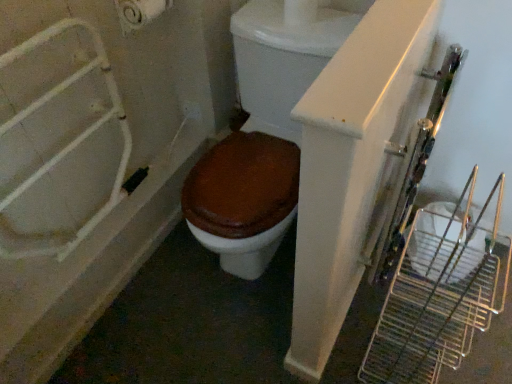
Question: Does brown matte toilet at center have a lesser height compared to white matte toilet paper at upper left?

Choices:
 (A) no
 (B) yes

Answer: (A)

Question: Is brown matte toilet at center positioned with its back to white matte toilet paper at upper left?

Choices:
 (A) yes
 (B) no

Answer: (B)

Question: From a real-world perspective, is brown matte toilet at center located beneath white matte toilet paper at upper left?

Choices:
 (A) yes
 (B) no

Answer: (A)

Question: From a real-world perspective, is brown matte toilet at center located higher than white matte toilet paper at upper left?

Choices:
 (A) no
 (B) yes

Answer: (A)

Question: Is brown matte toilet at center located outside white matte toilet paper at upper left?

Choices:
 (A) no
 (B) yes

Answer: (B)

Question: From a real-world perspective, relative to brown matte toilet at center, is white matte toilet paper at upper left vertically above or below?

Choices:
 (A) above
 (B) below

Answer: (A)

Question: Choose the correct answer: Is white matte toilet paper at upper left inside brown matte toilet at center or outside it?

Choices:
 (A) outside
 (B) inside

Answer: (A)

Question: Looking at the image, does white matte toilet paper at upper left seem bigger or smaller compared to brown matte toilet at center?

Choices:
 (A) big
 (B) small

Answer: (B)

Question: Is point (138, 3) closer or farther from the camera than point (231, 251)?

Choices:
 (A) farther
 (B) closer

Answer: (A)

Question: In the image, is white glossy bathtub at left positioned in front of or behind white matte toilet paper at upper left?

Choices:
 (A) front
 (B) behind

Answer: (A)

Question: From the image's perspective, is white glossy bathtub at left positioned above or below white matte toilet paper at upper left?

Choices:
 (A) above
 (B) below

Answer: (B)

Question: Considering the positions of white glossy bathtub at left and white matte toilet paper at upper left in the image, is white glossy bathtub at left wider or thinner than white matte toilet paper at upper left?

Choices:
 (A) thin
 (B) wide

Answer: (B)

Question: From a real-world perspective, is white glossy bathtub at left above or below white matte toilet paper at upper left?

Choices:
 (A) below
 (B) above

Answer: (A)

Question: Is white matte toilet paper at upper left wider or thinner than white glossy bathtub at left?

Choices:
 (A) wide
 (B) thin

Answer: (B)

Question: Does point (157, 1) appear closer or farther from the camera than point (26, 375)?

Choices:
 (A) farther
 (B) closer

Answer: (A)